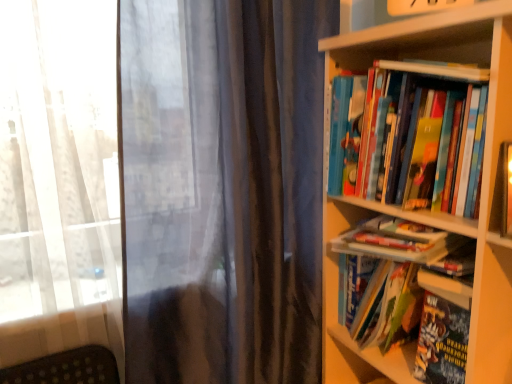
Question: Considering the relative positions of hardcover book at center, the 2th book ordered from the bottom, and hardcover book at right, which ranks as the fifth book in top-to-bottom order, in the image provided, is hardcover book at center, the 2th book ordered from the bottom, to the left or to the right of hardcover book at right, which ranks as the fifth book in top-to-bottom order,?

Choices:
 (A) left
 (B) right

Answer: (A)

Question: From the image's perspective, relative to hardcover book at right, which ranks as the fifth book in top-to-bottom order, is hardcover book at center, the 2th book ordered from the bottom, above or below?

Choices:
 (A) above
 (B) below

Answer: (A)

Question: Which of these objects is positioned farthest from the hardcover books at right, which appears as the first book when viewed from the top?

Choices:
 (A) hardcover book at right, the 1th book ordered from the bottom
 (B) white matte bookshelf at right
 (C) hardcover book at center right, the 2th book viewed from the top
 (D) hardcover book at center, the 2th book ordered from the bottom
 (E) hardcover book at right, arranged as the third book when ordered from the bottom

Answer: (A)

Question: Based on their relative distances, which object is nearer to the hardcover book at right, which ranks as the fifth book in top-to-bottom order?

Choices:
 (A) hardcover book at center right, the 2th book viewed from the top
 (B) hardcover book at center, the 2th book ordered from the bottom
 (C) hardcover book at right, arranged as the third book when ordered from the bottom
 (D) hardcover books at right, the 5th book in the bottom-to-top sequence
 (E) white matte bookshelf at right

Answer: (B)